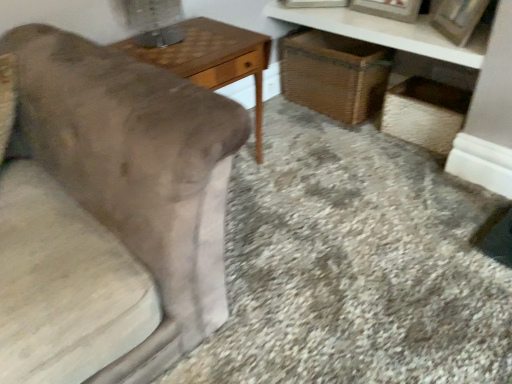
Question: From the image's perspective, does metallic silver table lamp at upper left appear lower than wooden picture frame at upper right?

Choices:
 (A) yes
 (B) no

Answer: (A)

Question: Is there a large distance between metallic silver table lamp at upper left and wooden picture frame at upper right?

Choices:
 (A) yes
 (B) no

Answer: (A)

Question: Does metallic silver table lamp at upper left appear on the left side of wooden picture frame at upper right?

Choices:
 (A) yes
 (B) no

Answer: (A)

Question: Considering the relative sizes of metallic silver table lamp at upper left and wooden picture frame at upper right in the image provided, is metallic silver table lamp at upper left taller than wooden picture frame at upper right?

Choices:
 (A) no
 (B) yes

Answer: (A)

Question: Is the surface of metallic silver table lamp at upper left in direct contact with wooden picture frame at upper right?

Choices:
 (A) no
 (B) yes

Answer: (A)

Question: Is metallic silver table lamp at upper left oriented towards wooden picture frame at upper right?

Choices:
 (A) yes
 (B) no

Answer: (B)

Question: Is metallic silver table lamp at upper left shorter than woodenobject at left?

Choices:
 (A) yes
 (B) no

Answer: (A)

Question: Is the depth of metallic silver table lamp at upper left less than that of woodenobject at left?

Choices:
 (A) yes
 (B) no

Answer: (B)

Question: Does metallic silver table lamp at upper left turn towards woodenobject at left?

Choices:
 (A) no
 (B) yes

Answer: (A)

Question: Is metallic silver table lamp at upper left not near woodenobject at left?

Choices:
 (A) yes
 (B) no

Answer: (B)

Question: Considering the relative sizes of metallic silver table lamp at upper left and woodenobject at left in the image provided, is metallic silver table lamp at upper left thinner than woodenobject at left?

Choices:
 (A) yes
 (B) no

Answer: (A)

Question: Can you confirm if metallic silver table lamp at upper left is bigger than woodenobject at left?

Choices:
 (A) yes
 (B) no

Answer: (B)

Question: Is woven straw basket at lower right outside of velvet beige couch at left?

Choices:
 (A) yes
 (B) no

Answer: (A)